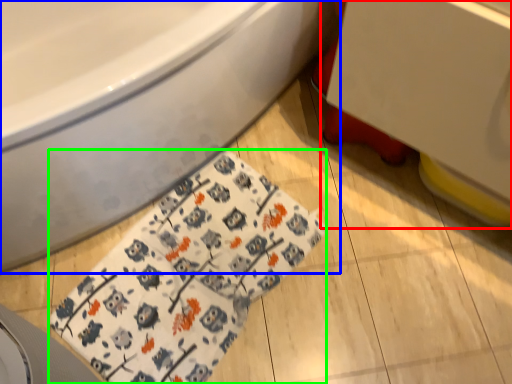
Question: Which object is the closest to the sink (highlighted by a red box)? Choose among these: bathtub (highlighted by a blue box) or blanket (highlighted by a green box).

Choices:
 (A) bathtub
 (B) blanket

Answer: (A)